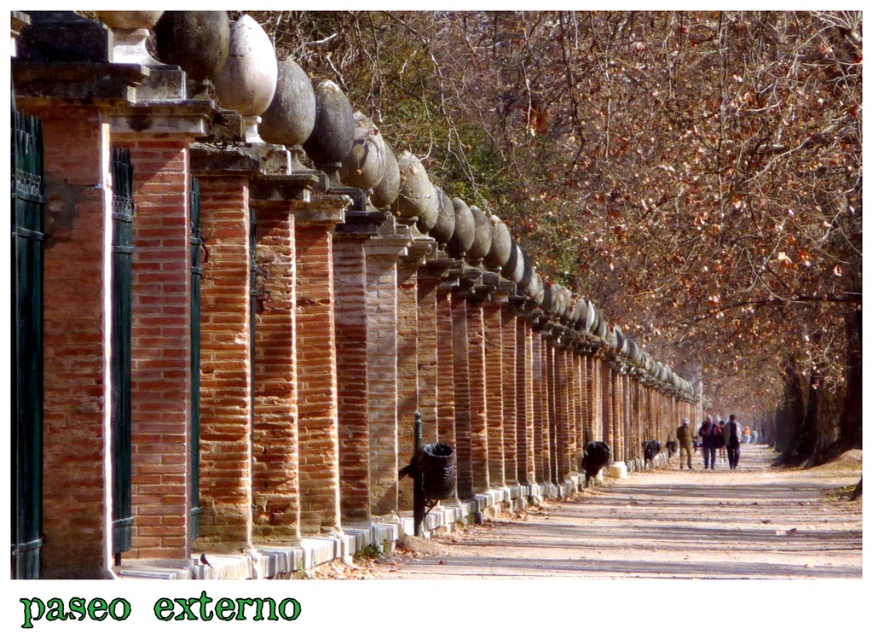
Between brown textured wall at center and dark brown leather jacket at center, which one has less height?

dark brown leather jacket at center is shorter.

Who is lower down, brown textured wall at center or dark brown leather jacket at center?

Positioned lower is dark brown leather jacket at center.

Describe the element at coordinates (650, 173) in the screenshot. I see `brown textured wall at center` at that location.

The image size is (873, 640). In order to click on brown textured wall at center in this screenshot , I will do `click(650, 173)`.

Which is behind, point (709, 464) or point (682, 432)?

Positioned behind is point (682, 432).

Does dark brown leather jacket at center have a larger size compared to brown leather jacket at center-right?

Yes.

At what (x,y) coordinates should I click in order to perform the action: click on dark brown leather jacket at center. Please return your answer as a coordinate pair (x, y). The height and width of the screenshot is (640, 873). Looking at the image, I should click on (709, 440).

At what (x,y) coordinates should I click in order to perform the action: click on dark brown leather jacket at center. Please return your answer as a coordinate pair (x, y). Looking at the image, I should click on (709, 440).

Who is higher up, brown dirt path at center or dark brown leather jacket at center-right?

brown dirt path at center is higher up.

Does brown dirt path at center have a smaller size compared to dark brown leather jacket at center-right?

No, brown dirt path at center is not smaller than dark brown leather jacket at center-right.

Locate an element on the screen. Image resolution: width=873 pixels, height=640 pixels. brown dirt path at center is located at coordinates (672, 528).